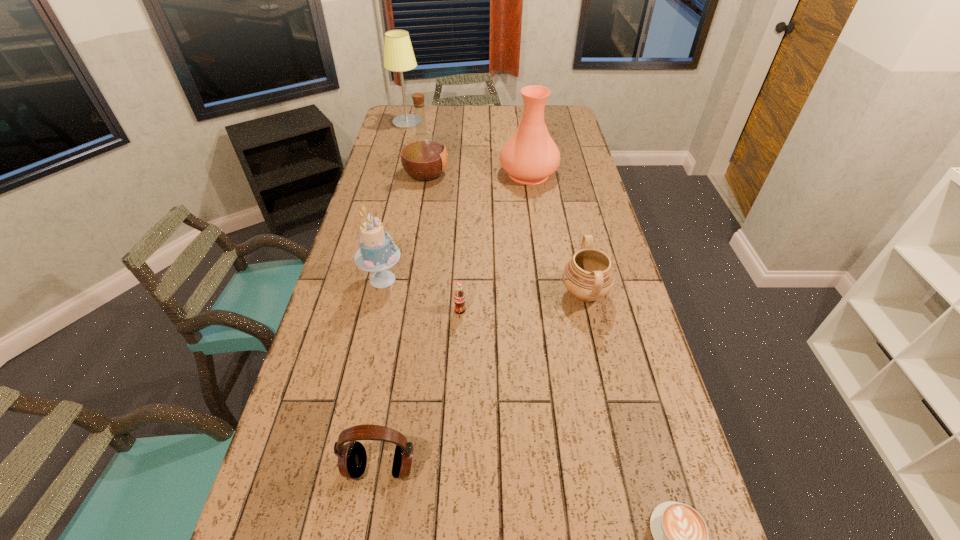
You are a GUI agent. You are given a task and a screenshot of the screen. Output one action in this format:
    pyautogui.click(x=<x>, y=<y>)
    Task: Click on the headset present at the left edge
    
    Given the screenshot: What is the action you would take?
    pyautogui.click(x=352, y=458)

This screenshot has height=540, width=960. Find the location of `vase that is at the right edge`. vase that is at the right edge is located at coordinates (530, 156).

The height and width of the screenshot is (540, 960). Find the location of `urn situated at the right edge`. urn situated at the right edge is located at coordinates (588, 276).

Locate an element on the screen. The image size is (960, 540). object that is positioned at the far left corner is located at coordinates (398, 53).

The width and height of the screenshot is (960, 540). In order to click on free space at the left edge of the desktop in this screenshot , I will do `click(359, 221)`.

Locate an element on the screen. The height and width of the screenshot is (540, 960). free space at the right edge is located at coordinates (582, 154).

You are a GUI agent. You are given a task and a screenshot of the screen. Output one action in this format:
    pyautogui.click(x=<x>, y=<y>)
    Task: Click on the vacant area between the cake and the urn
    
    Given the screenshot: What is the action you would take?
    pyautogui.click(x=484, y=286)

Find the location of a particular element. empty space between the table lamp and the vase is located at coordinates (468, 148).

Where is `free area in between the table lamp and the headset`? free area in between the table lamp and the headset is located at coordinates click(394, 295).

The width and height of the screenshot is (960, 540). What are the coordinates of `vacant area that lies between the vase and the urn` in the screenshot? It's located at (557, 233).